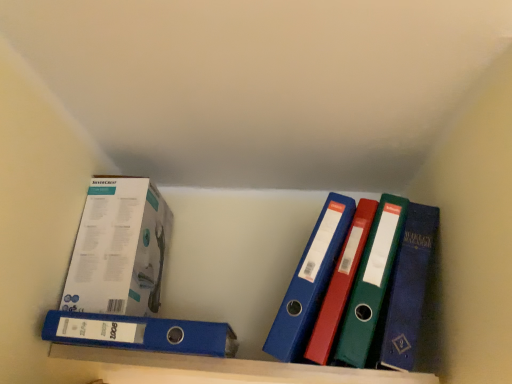
Question: In terms of height, does white cardboard box at upper left look taller or shorter compared to blue plastic shelf at lower center?

Choices:
 (A) tall
 (B) short

Answer: (A)

Question: From the image's perspective, relative to blue plastic shelf at lower center, is white cardboard box at upper left above or below?

Choices:
 (A) below
 (B) above

Answer: (B)

Question: Based on their relative distances, which object is farther from the blue plastic shelf at lower center?

Choices:
 (A) white cardboard box at upper left
 (B) blue plastic binder at lower left

Answer: (A)

Question: Based on their relative distances, which object is farther from the blue plastic binder at lower left?

Choices:
 (A) white cardboard box at upper left
 (B) blue plastic shelf at lower center

Answer: (A)